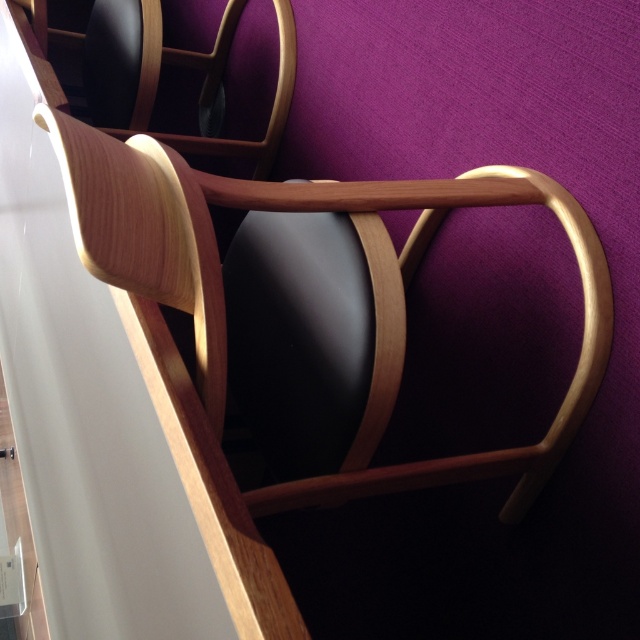
You are an interior designer trying to arrange furniture in a small living room. You have a white glossy table at left and a wooden armchair at center. The distance between them is crucial for comfort. Can you determine if the 12.66 inches between them is sufficient for a person to walk comfortably between them?

The distance between the white glossy table at left and the wooden armchair at center is 12.66 inches. This is insufficient for a person to walk comfortably between them, as typical recommendations suggest at least 24 inches of space for comfortable passage.

You are standing in front of the wooden chair and notice a point at coordinates (113, 426). Based on the scene, what object is located at that point?

The point at coordinates (113, 426) corresponds to the white glossy table at left.